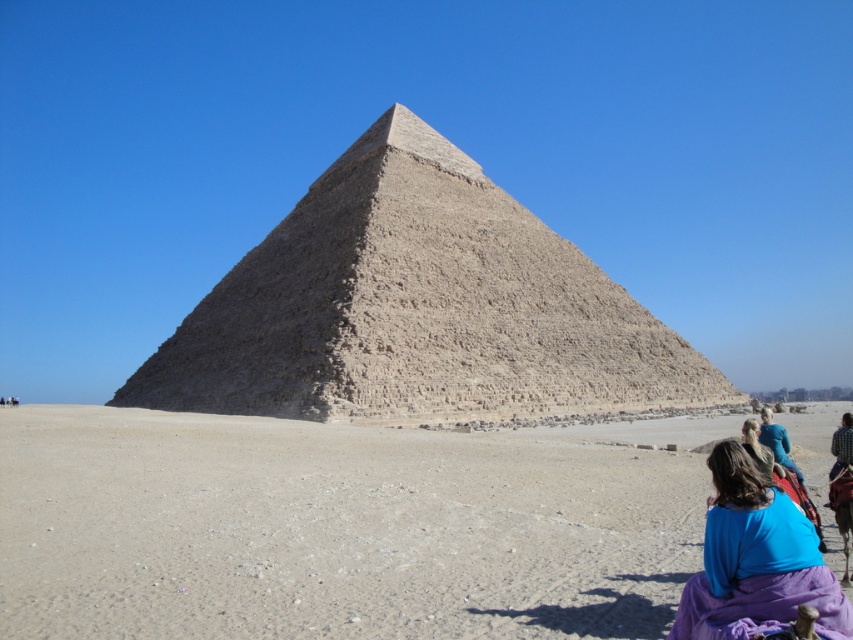
You are a tourist standing at the base of the Pyramid of Khafre. You notice the brown sandy desert at center and the purple fabric at lower right. Which object is positioned to the left of the other?

The brown sandy desert at center is to the left of the purple fabric at lower right.